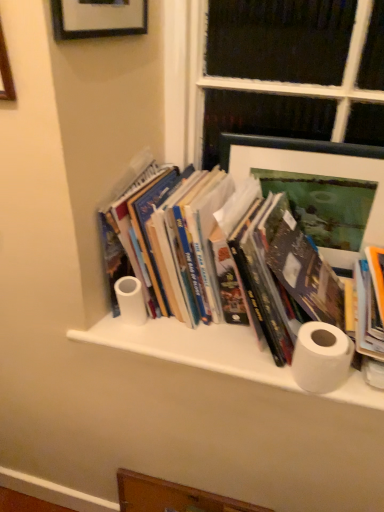
In order to click on vacant space that is to the left of white matte toilet paper at right, placed as the second toilet paper when sorted from back to front in this screenshot , I will do `click(242, 355)`.